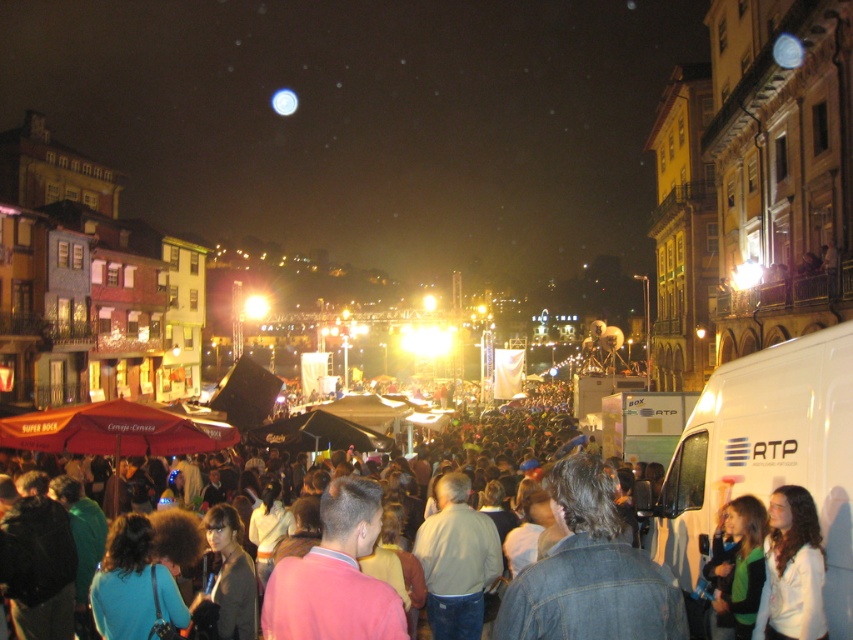
You are a photographer at the concert and need to capture both the white matte jacket at lower right and the denim jacket at center in a single frame. Considering their sizes, which jacket will appear smaller in the photo?

The white matte jacket at lower right will appear smaller in the photo because it occupies less space than the denim jacket at center.

You are at the concert and want to move from your current position to the stage. There is a white matte van at lower right and a denim jacket at lower right blocking your path. Which object should you move around to reach the stage more directly?

To reach the stage more directly, you should move around the white matte van at lower right since it is positioned on the right side of the denim jacket at lower right, meaning the van is further to the right, allowing you to go around it towards the stage.